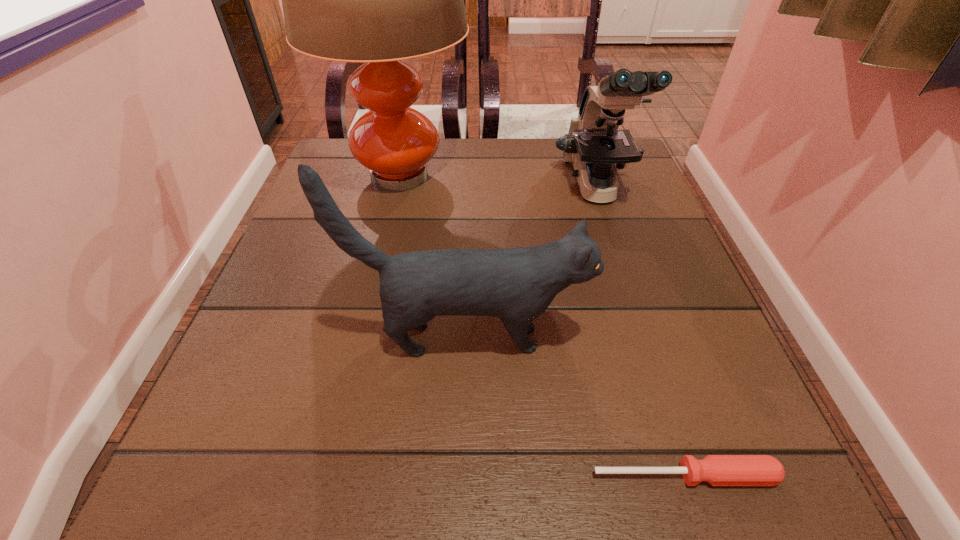
Locate an element on the screen. blank space that satisfies the following two spatial constraints: 1. on the back side of the shortest object; 2. at the face of the cat is located at coordinates (641, 339).

At what (x,y) coordinates should I click in order to perform the action: click on vacant area that satisfies the following two spatial constraints: 1. at the face of the shortest object; 2. on the left side of the third farthest object. Please return your answer as a coordinate pair (x, y). Looking at the image, I should click on (464, 476).

In order to click on free spot that satisfies the following two spatial constraints: 1. on the front side of the nearest object; 2. on the right side of the lamp in this screenshot , I will do `click(330, 476)`.

At what (x,y) coordinates should I click in order to perform the action: click on free location that satisfies the following two spatial constraints: 1. at the face of the nearest object; 2. on the right side of the second nearest object. Please return your answer as a coordinate pair (x, y). The width and height of the screenshot is (960, 540). Looking at the image, I should click on (464, 476).